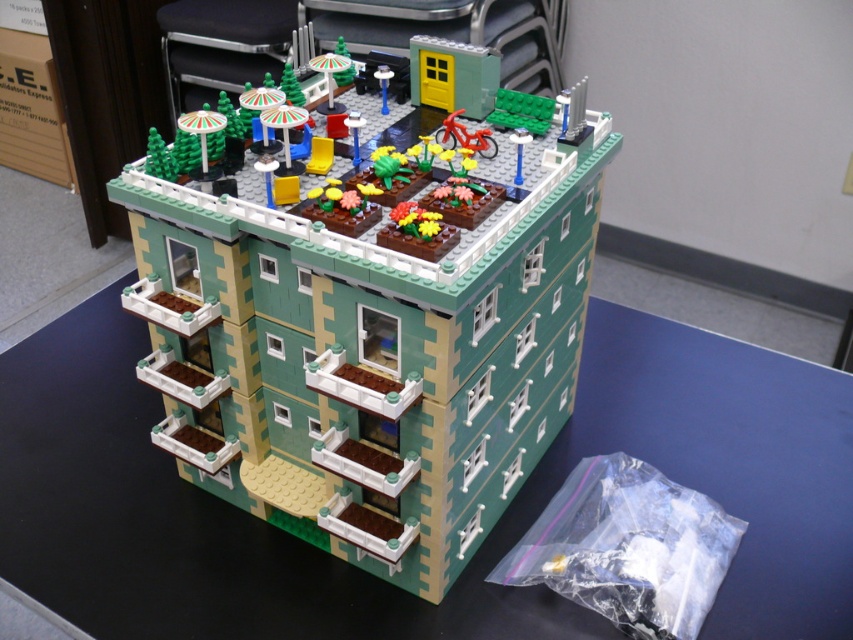
You are a LEGO architect designing a rooftop garden for the green matte building at center and green plastic table at center. Which object requires a larger base to accommodate its size?

The green plastic table at center requires a larger base because it is bigger than the green matte building at center.

You are standing at the entrance of the LEGO building and want to reach the red bicycle. There are two points marked on the path leading to the bicycle. The first point is at coordinate point (x=442, y=595) and the second point is at coordinate point (x=161, y=516). Which point should you step on first to reach the bicycle?

You should step on point (x=442, y=595) first because it is in front of point (x=161, y=516), meaning it is closer to your starting position at the entrance.

You are a delivery drone that needs to land on the rooftop of the green matte building at center. There is a green plastic table at center on the rooftop. The drone has a wingspan of 12 inches. Can the drone safely land on the rooftop without hitting the table?

The green matte building at center and green plastic table at center are 11.12 inches apart. Since the drone has a wingspan of 12 inches, it cannot safely land without risking collision with the table as the distance between them is less than the drone